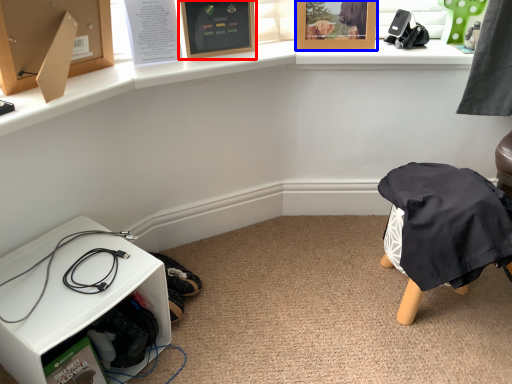
Question: Which point is further to the camera, picture frame (highlighted by a red box) or picture frame (highlighted by a blue box)?

Choices:
 (A) picture frame
 (B) picture frame

Answer: (B)